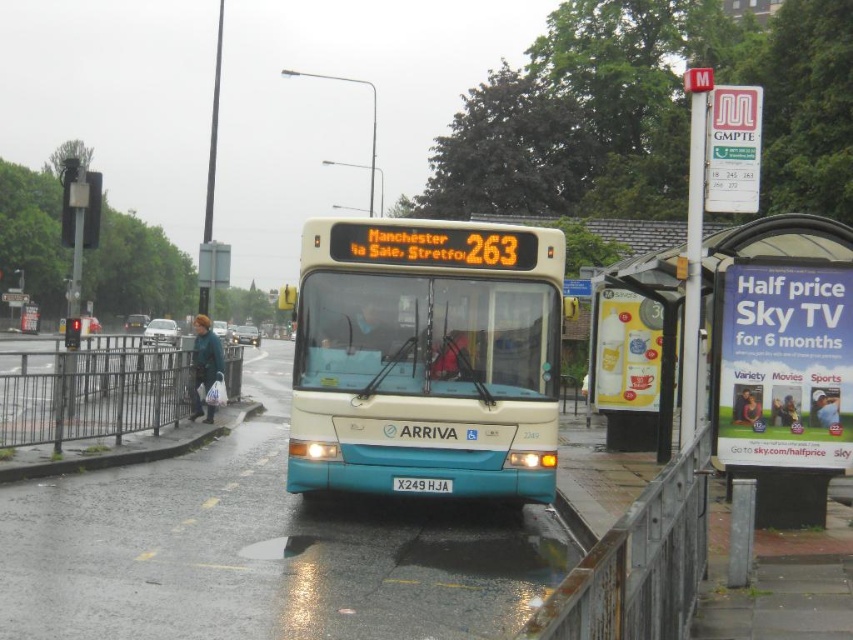
You are a photographer standing at the bus stop shelter. You want to take a photo of the two points mentioned. Which point, point (364, 312) or point (36, 467), will appear larger in your photo?

Point (364, 312) will appear larger in the photo because it is closer to the camera than point (36, 467).